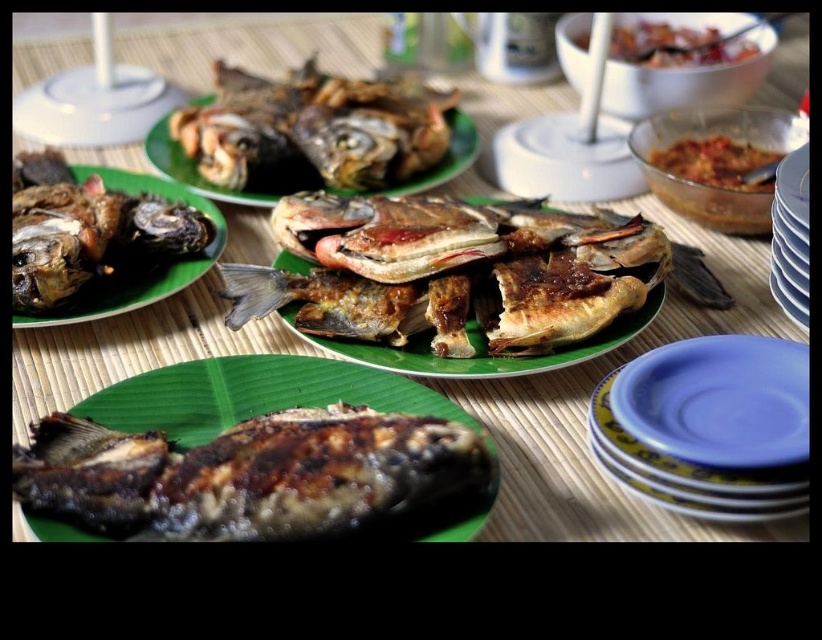
You are a chef arranging dishes on a table. You have two brown fish dishes, the brown crispy fish at center and the brown matte fish at center. You need to place them so that one is above the other. Which fish should you place on top to match the image?

The brown crispy fish at center is positioned under the brown matte fish at center, so to match the image, place the brown matte fish at center on top of the brown crispy fish at center.

You are a food critic inspecting this table setting. You notice the brown crispy fish at center and the green matte plate at center. Which object is located to the right of the other?

The brown crispy fish at center is positioned on the right side of green matte plate at center.